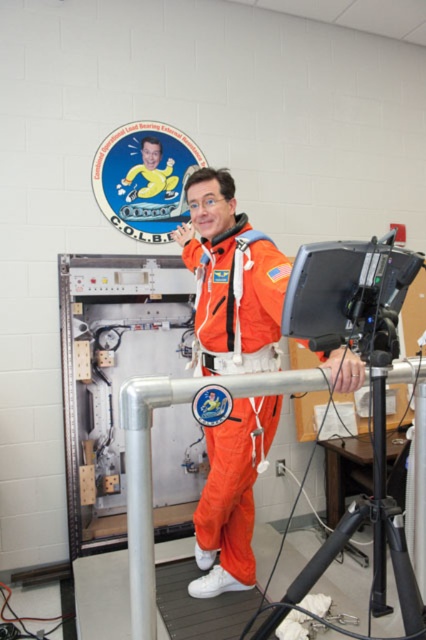
You are an astronaut preparing for a mission and need to move from your current position to the emergency exit located behind the black plastic tripod at lower right. Considering the space available, can you safely maneuver around the orange fabric spacesuit at center without causing a collision?

The orange fabric spacesuit at center might be wider than the black plastic tripod at lower right, so there is a possibility of collision if you try to maneuver around it. You should plan a different path to avoid any accidents.

You are an astronaut in training and need to locate two points marked in the scene. The first point is at coordinates point [216,336] and the second is at point [273,628]. Which point is closer to you as you face the scene?

Point [216,336] is closer to you because it is further to the viewer than point [273,628].